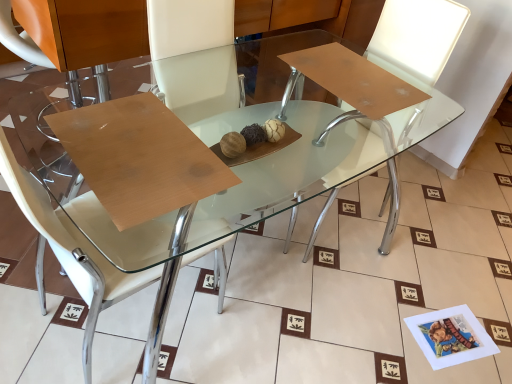
Question: Is white leather chair at center, which ranks as the first chair in right-to-left order, taller than white leather chair at center, which is counted as the second chair, starting from the right?

Choices:
 (A) yes
 (B) no

Answer: (B)

Question: Is white leather chair at center, acting as the 2th chair starting from the left, bigger than white leather chair at center, the first chair in the left-to-right sequence?

Choices:
 (A) no
 (B) yes

Answer: (A)

Question: Does white leather chair at center, which ranks as the first chair in right-to-left order, have a lesser height compared to white leather chair at center, which is counted as the second chair, starting from the right?

Choices:
 (A) no
 (B) yes

Answer: (B)

Question: From a real-world perspective, is white leather chair at center, acting as the 2th chair starting from the left, below white leather chair at center, which is counted as the second chair, starting from the right?

Choices:
 (A) no
 (B) yes

Answer: (B)

Question: From the image's perspective, is white leather chair at center, acting as the 2th chair starting from the left, located beneath white leather chair at center, the first chair in the left-to-right sequence?

Choices:
 (A) no
 (B) yes

Answer: (A)

Question: Is white leather chair at center, acting as the 2th chair starting from the left, taller or shorter than white leather chair at center, the first chair in the left-to-right sequence?

Choices:
 (A) tall
 (B) short

Answer: (B)

Question: From the image's perspective, is white leather chair at center, which ranks as the first chair in right-to-left order, positioned above or below white leather chair at center, which is counted as the second chair, starting from the right?

Choices:
 (A) below
 (B) above

Answer: (B)

Question: Is white leather chair at center, which ranks as the first chair in right-to-left order, wider or thinner than white leather chair at center, which is counted as the second chair, starting from the right?

Choices:
 (A) thin
 (B) wide

Answer: (B)

Question: Considering the positions of point (350, 182) and point (81, 357), is point (350, 182) closer or farther from the camera than point (81, 357)?

Choices:
 (A) closer
 (B) farther

Answer: (B)

Question: From the image's perspective, relative to wooden at center, is white leather chair at center, acting as the 2th chair starting from the left, above or below?

Choices:
 (A) above
 (B) below

Answer: (A)

Question: Is white leather chair at center, acting as the 2th chair starting from the left, spatially inside wooden at center, or outside of it?

Choices:
 (A) inside
 (B) outside

Answer: (B)

Question: Considering the relative positions of white leather chair at center, acting as the 2th chair starting from the left, and wooden at center in the image provided, is white leather chair at center, acting as the 2th chair starting from the left, to the left or to the right of wooden at center?

Choices:
 (A) left
 (B) right

Answer: (B)

Question: Looking at their shapes, would you say white leather chair at center, acting as the 2th chair starting from the left, is wider or thinner than wooden at center?

Choices:
 (A) thin
 (B) wide

Answer: (B)

Question: Would you say white leather chair at center, which is counted as the second chair, starting from the right, is inside or outside white leather chair at center, acting as the 2th chair starting from the left?

Choices:
 (A) outside
 (B) inside

Answer: (A)

Question: Considering the relative positions of white leather chair at center, the first chair in the left-to-right sequence, and white leather chair at center, which ranks as the first chair in right-to-left order, in the image provided, is white leather chair at center, the first chair in the left-to-right sequence, to the left or to the right of white leather chair at center, which ranks as the first chair in right-to-left order,?

Choices:
 (A) left
 (B) right

Answer: (A)